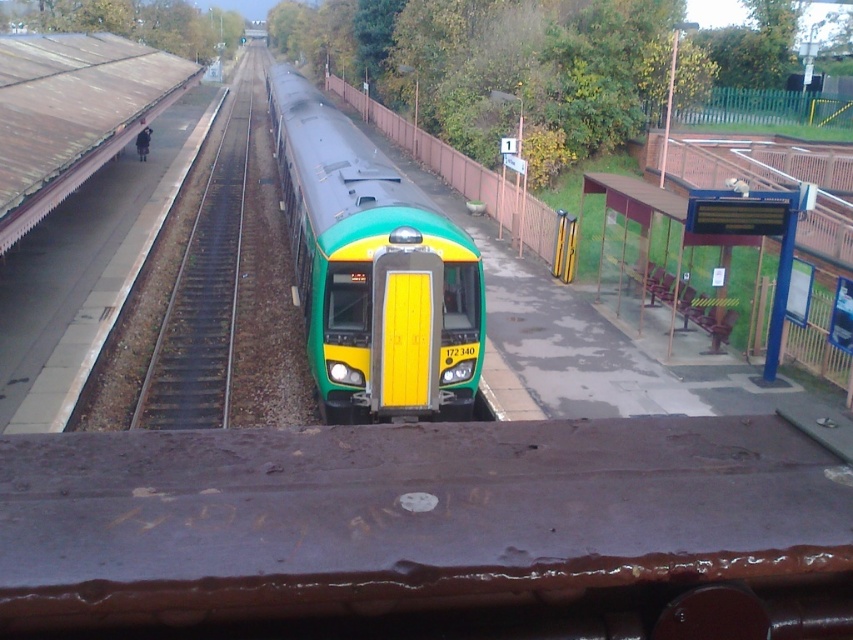
Question: Among these objects, which one is nearest to the camera?

Choices:
 (A) green matte train at center
 (B) brown gravel train track at left

Answer: (A)

Question: Can you confirm if green matte train at center is positioned to the right of brown gravel train track at left?

Choices:
 (A) yes
 (B) no

Answer: (A)

Question: Which point is closer to the camera?

Choices:
 (A) (186, 276)
 (B) (289, 145)

Answer: (A)

Question: Is green matte train at center positioned behind brown gravel train track at left?

Choices:
 (A) yes
 (B) no

Answer: (B)

Question: Can you confirm if green matte train at center is positioned to the left of brown gravel train track at left?

Choices:
 (A) yes
 (B) no

Answer: (B)